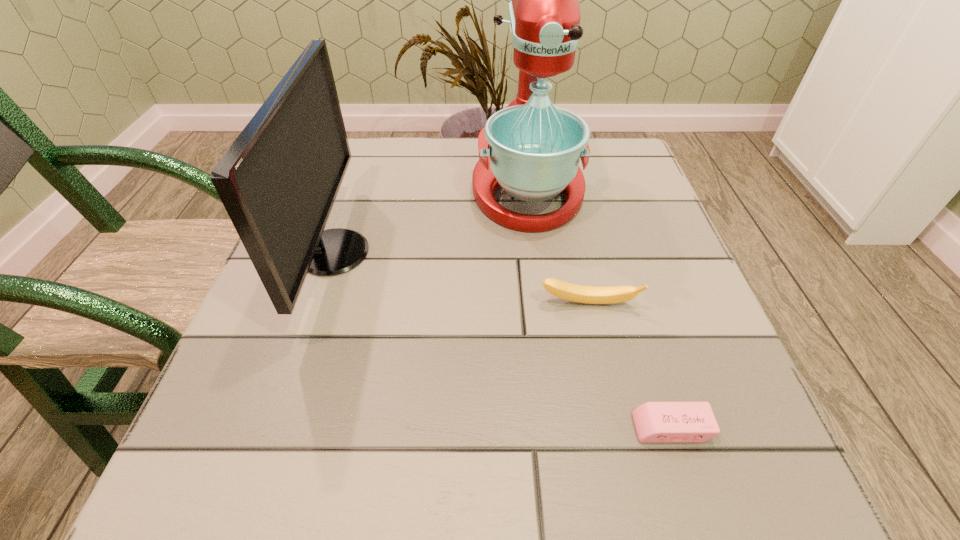
This screenshot has height=540, width=960. In order to click on vacant region between the tallest object and the second shortest object in this screenshot , I will do `click(558, 246)`.

This screenshot has width=960, height=540. Find the location of `free space between the banana and the eraser`. free space between the banana and the eraser is located at coordinates (630, 366).

Find the location of a particular element. The image size is (960, 540). vacant area that lies between the tallest object and the banana is located at coordinates (558, 246).

Where is `empty location between the eraser and the tallest object`? The width and height of the screenshot is (960, 540). empty location between the eraser and the tallest object is located at coordinates (599, 308).

Identify the location of empty location between the computer monitor and the banana. The height and width of the screenshot is (540, 960). (461, 278).

What are the coordinates of `object identified as the closest to the eraser` in the screenshot? It's located at (571, 292).

Identify the location of object identified as the second closest to the banana. (655, 422).

Where is `free spot that satisfies the following two spatial constraints: 1. on the front-facing side of the tallest object; 2. on the front-facing side of the computer monitor`? Image resolution: width=960 pixels, height=540 pixels. free spot that satisfies the following two spatial constraints: 1. on the front-facing side of the tallest object; 2. on the front-facing side of the computer monitor is located at coordinates (536, 252).

Identify the location of vacant area in the image that satisfies the following two spatial constraints: 1. on the front-facing side of the tallest object; 2. on the front-facing side of the third shortest object. This screenshot has height=540, width=960. (536, 252).

This screenshot has width=960, height=540. What are the coordinates of `vacant point that satisfies the following two spatial constraints: 1. on the front-facing side of the mixer; 2. on the left side of the eraser` in the screenshot? It's located at (558, 428).